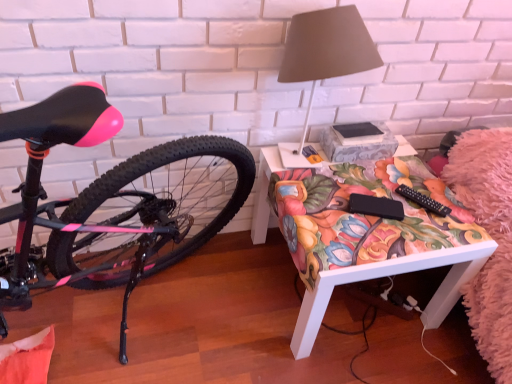
In order to click on free space in front of matte gray lampshade at upper right in this screenshot , I will do `click(334, 220)`.